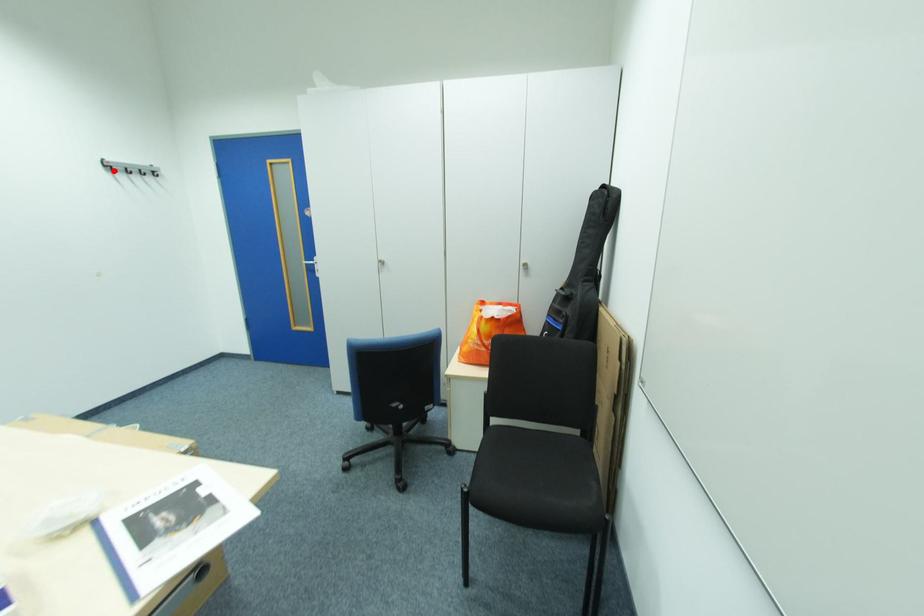
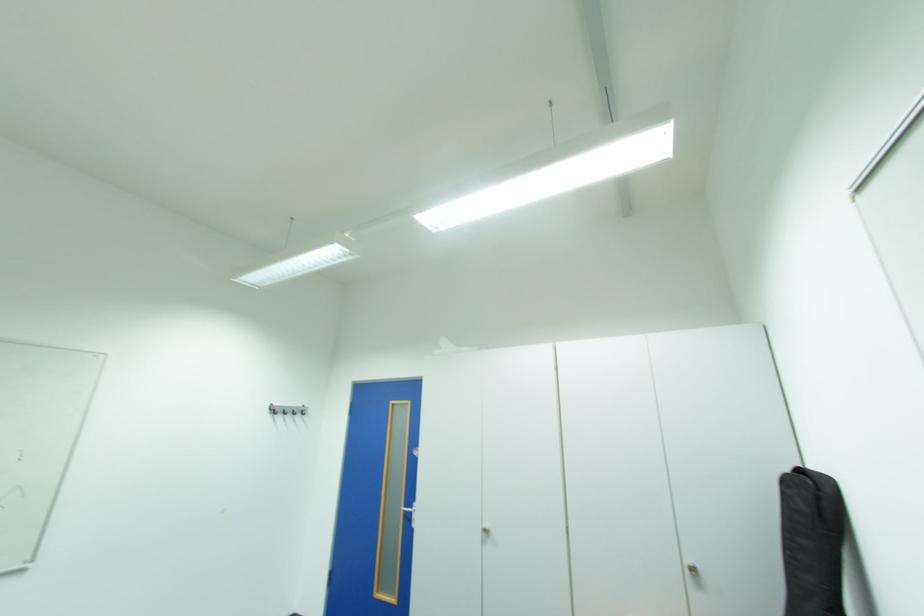
In the second image, find the point that corresponds to the highlighted location in the first image.

(280, 411)